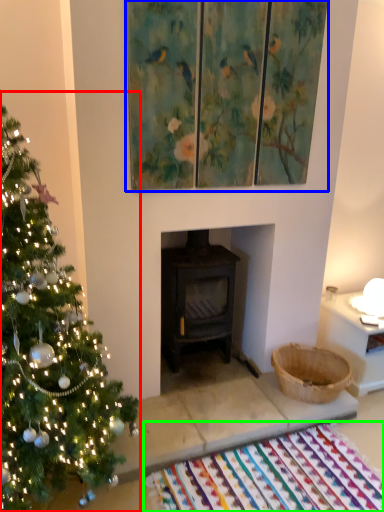
Question: Considering the real-world distances, which object is farthest from christmas tree (highlighted by a red box)? picture frame (highlighted by a blue box) or mat (highlighted by a green box)?

Choices:
 (A) picture frame
 (B) mat

Answer: (A)